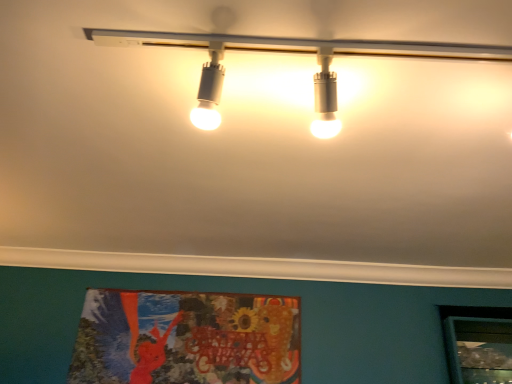
What do you see at coordinates (291, 52) in the screenshot? I see `white glossy track lights at upper center` at bounding box center [291, 52].

At what (x,y) coordinates should I click in order to perform the action: click on white glossy track lights at upper center. Please return your answer as a coordinate pair (x, y). Image resolution: width=512 pixels, height=384 pixels. Looking at the image, I should click on (291, 52).

Describe the element at coordinates (187, 338) in the screenshot. I see `textured fabric poster at lower center` at that location.

At what (x,y) coordinates should I click in order to perform the action: click on textured fabric poster at lower center. Please return your answer as a coordinate pair (x, y). This screenshot has width=512, height=384. Looking at the image, I should click on (187, 338).

Find the location of `white glossy track lights at upper center`. white glossy track lights at upper center is located at coordinates (291, 52).

Looking at this image, is textured fabric poster at lower center at the right side of white glossy track lights at upper center?

Incorrect, textured fabric poster at lower center is not on the right side of white glossy track lights at upper center.

Considering the relative positions of textured fabric poster at lower center and white glossy track lights at upper center in the image provided, is textured fabric poster at lower center behind white glossy track lights at upper center?

Yes, textured fabric poster at lower center is further from the viewer.

In the scene shown: Which is farther from the camera, (257, 340) or (326, 122)?

The point (257, 340) is farther.

From the image's perspective, is textured fabric poster at lower center beneath white glossy track lights at upper center?

Yes, from the image's perspective, textured fabric poster at lower center is beneath white glossy track lights at upper center.

From a real-world perspective, is textured fabric poster at lower center physically below white glossy track lights at upper center?

Yes, from a real-world perspective, textured fabric poster at lower center is below white glossy track lights at upper center.

Is textured fabric poster at lower center wider or thinner than white glossy track lights at upper center?

Considering their sizes, textured fabric poster at lower center looks slimmer than white glossy track lights at upper center.

Which of these two, textured fabric poster at lower center or white glossy track lights at upper center, stands shorter?

With less height is white glossy track lights at upper center.

Considering the sizes of textured fabric poster at lower center and white glossy track lights at upper center in the image, is textured fabric poster at lower center bigger or smaller than white glossy track lights at upper center?

In the image, textured fabric poster at lower center appears to be smaller than white glossy track lights at upper center.

Which is correct: textured fabric poster at lower center is inside white glossy track lights at upper center, or outside of it?

textured fabric poster at lower center is not inside white glossy track lights at upper center, it's outside.

Would you say textured fabric poster at lower center is a long distance from white glossy track lights at upper center?

Yes.

Is textured fabric poster at lower center oriented towards white glossy track lights at upper center?

Yes.

What's the angular difference between textured fabric poster at lower center and white glossy track lights at upper center's facing directions?

textured fabric poster at lower center and white glossy track lights at upper center are facing 90.8 degrees away from each other.

Identify the location of lamp above the textured fabric poster at lower center (from a real-world perspective). The image size is (512, 384). (291, 52).

Can you confirm if white glossy track lights at upper center is positioned to the right of textured fabric poster at lower center?

Correct, you'll find white glossy track lights at upper center to the right of textured fabric poster at lower center.

Is white glossy track lights at upper center positioned in front of textured fabric poster at lower center?

Yes, white glossy track lights at upper center is closer to the viewer.

Which is closer, (x=96, y=30) or (x=184, y=348)?

The point (x=96, y=30) is more forward.

From the image's perspective, between white glossy track lights at upper center and textured fabric poster at lower center, who is located below?

textured fabric poster at lower center appears lower in the image.

From a real-world perspective, which is physically above, white glossy track lights at upper center or textured fabric poster at lower center?

white glossy track lights at upper center is physically above.

Is white glossy track lights at upper center thinner than textured fabric poster at lower center?

In fact, white glossy track lights at upper center might be wider than textured fabric poster at lower center.

Considering the relative sizes of white glossy track lights at upper center and textured fabric poster at lower center in the image provided, is white glossy track lights at upper center taller than textured fabric poster at lower center?

No.

Considering the sizes of objects white glossy track lights at upper center and textured fabric poster at lower center in the image provided, who is smaller, white glossy track lights at upper center or textured fabric poster at lower center?

textured fabric poster at lower center is smaller.

Is white glossy track lights at upper center located outside textured fabric poster at lower center?

Indeed, white glossy track lights at upper center is completely outside textured fabric poster at lower center.

Is white glossy track lights at upper center far from textured fabric poster at lower center?

white glossy track lights at upper center is positioned a significant distance from textured fabric poster at lower center.

Is white glossy track lights at upper center turned away from textured fabric poster at lower center?

That's not correct — white glossy track lights at upper center is not looking away from textured fabric poster at lower center.

The height and width of the screenshot is (384, 512). Identify the location of lamp above the textured fabric poster at lower center (from the image's perspective). pyautogui.click(x=291, y=52).

What are the coordinates of `lamp that is on the right side of textured fabric poster at lower center` in the screenshot? It's located at tap(291, 52).

Locate an element on the screen. poster page below the white glossy track lights at upper center (from the image's perspective) is located at coordinates pyautogui.click(x=187, y=338).